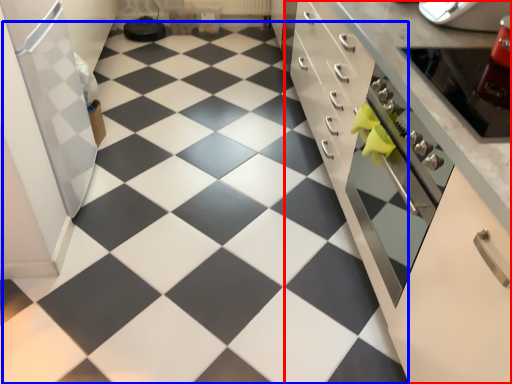
Question: Which object appears closest to the camera in this image, cabinetry (highlighted by a red box) or tile (highlighted by a blue box)?

Choices:
 (A) cabinetry
 (B) tile

Answer: (A)